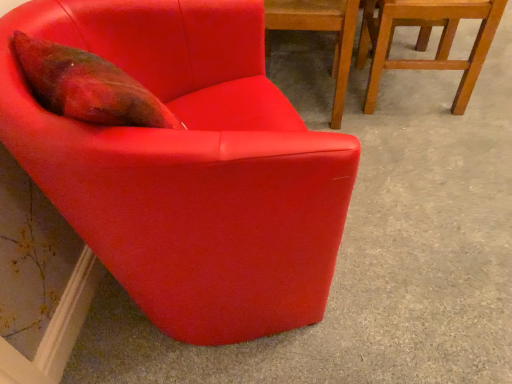
This screenshot has height=384, width=512. In order to click on wooden chair at upper right, which appears as the 3th chair when viewed from the left in this screenshot , I will do `click(426, 39)`.

Considering the positions of points (39, 25) and (350, 17), is point (39, 25) farther from camera compared to point (350, 17)?

No, (39, 25) is in front of (350, 17).

Considering the sizes of objects matte red armchair at upper left, arranged as the 3th chair when viewed from the right, and matte red chair at center, the second chair positioned from the right, in the image provided, who is smaller, matte red armchair at upper left, arranged as the 3th chair when viewed from the right, or matte red chair at center, the second chair positioned from the right,?

matte red chair at center, the second chair positioned from the right.

From the image's perspective, who appears lower, matte red armchair at upper left, which is counted as the first chair, starting from the left, or matte red chair at center, the second chair positioned from the right?

matte red armchair at upper left, which is counted as the first chair, starting from the left, from the image's perspective.

Consider the image. Which is in front, matte red chair at center, the second chair positioned from the right, or wooden chair at upper right, which appears as the 3th chair when viewed from the left?

matte red chair at center, the second chair positioned from the right.

From the picture: From the image's perspective, between matte red chair at center, which ranks as the 2th chair in left-to-right order, and wooden chair at upper right, which appears as the 3th chair when viewed from the left, which one is located above?

wooden chair at upper right, which appears as the 3th chair when viewed from the left, appears higher in the image.

In the scene shown: Is matte red chair at center, the second chair positioned from the right, situated inside wooden chair at upper right, which appears as the 1th chair when viewed from the right, or outside?

matte red chair at center, the second chair positioned from the right, is not inside wooden chair at upper right, which appears as the 1th chair when viewed from the right, it's outside.

Is matte red chair at center, the second chair positioned from the right, thinner than wooden chair at upper right, which appears as the 3th chair when viewed from the left?

In fact, matte red chair at center, the second chair positioned from the right, might be wider than wooden chair at upper right, which appears as the 3th chair when viewed from the left.

Is wooden chair at upper right, which appears as the 3th chair when viewed from the left, inside or outside of matte red chair at center, which ranks as the 2th chair in left-to-right order?

wooden chair at upper right, which appears as the 3th chair when viewed from the left, is not inside matte red chair at center, which ranks as the 2th chair in left-to-right order, it's outside.

Where is `chair behind the matte red chair at center, which ranks as the 2th chair in left-to-right order`? chair behind the matte red chair at center, which ranks as the 2th chair in left-to-right order is located at coordinates (426, 39).

In terms of height, does wooden chair at upper right, which appears as the 3th chair when viewed from the left, look taller or shorter compared to matte red chair at center, which ranks as the 2th chair in left-to-right order?

Considering their sizes, wooden chair at upper right, which appears as the 3th chair when viewed from the left, has less height than matte red chair at center, which ranks as the 2th chair in left-to-right order.

Between wooden chair at upper right, which appears as the 3th chair when viewed from the left, and matte red chair at center, the second chair positioned from the right, which one is positioned behind?

wooden chair at upper right, which appears as the 3th chair when viewed from the left, is further from the camera.

From the image's perspective, which is above, matte red armchair at upper left, arranged as the 3th chair when viewed from the right, or wooden chair at upper right, which appears as the 1th chair when viewed from the right?

wooden chair at upper right, which appears as the 1th chair when viewed from the right, is shown above in the image.

Does matte red armchair at upper left, which is counted as the first chair, starting from the left, have a greater height compared to wooden chair at upper right, which appears as the 1th chair when viewed from the right?

Correct, matte red armchair at upper left, which is counted as the first chair, starting from the left, is much taller as wooden chair at upper right, which appears as the 1th chair when viewed from the right.

Looking at this image, what's the angular difference between matte red armchair at upper left, arranged as the 3th chair when viewed from the right, and wooden chair at upper right, which appears as the 3th chair when viewed from the left,'s facing directions?

160 degrees separate the facing orientations of matte red armchair at upper left, arranged as the 3th chair when viewed from the right, and wooden chair at upper right, which appears as the 3th chair when viewed from the left.

Is matte red armchair at upper left, which is counted as the first chair, starting from the left, facing towards wooden chair at upper right, which appears as the 1th chair when viewed from the right?

No.

In terms of height, does matte red chair at center, which ranks as the 2th chair in left-to-right order, look taller or shorter compared to matte red armchair at upper left, arranged as the 3th chair when viewed from the right?

Considering their sizes, matte red chair at center, which ranks as the 2th chair in left-to-right order, has less height than matte red armchair at upper left, arranged as the 3th chair when viewed from the right.

Is matte red chair at center, which ranks as the 2th chair in left-to-right order, not close to matte red armchair at upper left, which is counted as the first chair, starting from the left?

matte red chair at center, which ranks as the 2th chair in left-to-right order, is near matte red armchair at upper left, which is counted as the first chair, starting from the left, not far away.

Is matte red chair at center, the second chair positioned from the right, facing away from matte red armchair at upper left, arranged as the 3th chair when viewed from the right?

Yes, matte red chair at center, the second chair positioned from the right,'s orientation is away from matte red armchair at upper left, arranged as the 3th chair when viewed from the right.

Which of these two, matte red chair at center, which ranks as the 2th chair in left-to-right order, or matte red armchair at upper left, which is counted as the first chair, starting from the left, is wider?

With larger width is matte red armchair at upper left, which is counted as the first chair, starting from the left.

From a real-world perspective, is wooden chair at upper right, which appears as the 3th chair when viewed from the left, positioned under matte red armchair at upper left, which is counted as the first chair, starting from the left, based on gravity?

Indeed, from a real-world perspective, wooden chair at upper right, which appears as the 3th chair when viewed from the left, is positioned beneath matte red armchair at upper left, which is counted as the first chair, starting from the left.

Does wooden chair at upper right, which appears as the 3th chair when viewed from the left, lie in front of matte red armchair at upper left, arranged as the 3th chair when viewed from the right?

No, wooden chair at upper right, which appears as the 3th chair when viewed from the left, is further to the viewer.

Which is closer, [474,65] or [187,295]?

The point [187,295] is in front.

Locate an element on the screen. The image size is (512, 384). chair in front of the matte red chair at center, which ranks as the 2th chair in left-to-right order is located at coordinates (189, 168).

Find the location of `chair that is the 1st one when counting downward from the wooden chair at upper right, which appears as the 3th chair when viewed from the left (from the image's perspective)`. chair that is the 1st one when counting downward from the wooden chair at upper right, which appears as the 3th chair when viewed from the left (from the image's perspective) is located at coordinates coord(321,30).

Based on their spatial positions, is wooden chair at upper right, which appears as the 3th chair when viewed from the left, or matte red chair at center, which ranks as the 2th chair in left-to-right order, closer to matte red armchair at upper left, which is counted as the first chair, starting from the left?

matte red chair at center, which ranks as the 2th chair in left-to-right order, lies closer to matte red armchair at upper left, which is counted as the first chair, starting from the left, than the other object.

Looking at this image, looking at the image, which one is located further to matte red chair at center, which ranks as the 2th chair in left-to-right order, wooden chair at upper right, which appears as the 3th chair when viewed from the left, or matte red armchair at upper left, which is counted as the first chair, starting from the left?

Based on the image, matte red armchair at upper left, which is counted as the first chair, starting from the left, appears to be further to matte red chair at center, which ranks as the 2th chair in left-to-right order.

Estimate the real-world distances between objects in this image. Which object is closer to wooden chair at upper right, which appears as the 3th chair when viewed from the left, matte red chair at center, the second chair positioned from the right, or matte red armchair at upper left, arranged as the 3th chair when viewed from the right?

Among the two, matte red chair at center, the second chair positioned from the right, is located nearer to wooden chair at upper right, which appears as the 3th chair when viewed from the left.

Looking at the image, which one is located further to matte red chair at center, the second chair positioned from the right, matte red armchair at upper left, arranged as the 3th chair when viewed from the right, or wooden chair at upper right, which appears as the 3th chair when viewed from the left?

matte red armchair at upper left, arranged as the 3th chair when viewed from the right, is further to matte red chair at center, the second chair positioned from the right.

Based on their spatial positions, is matte red armchair at upper left, arranged as the 3th chair when viewed from the right, or matte red chair at center, which ranks as the 2th chair in left-to-right order, further from wooden chair at upper right, which appears as the 1th chair when viewed from the right?

matte red armchair at upper left, arranged as the 3th chair when viewed from the right, lies further to wooden chair at upper right, which appears as the 1th chair when viewed from the right, than the other object.

Considering their positions, is matte red chair at center, which ranks as the 2th chair in left-to-right order, positioned further to matte red armchair at upper left, arranged as the 3th chair when viewed from the right, than wooden chair at upper right, which appears as the 3th chair when viewed from the left?

Among the two, wooden chair at upper right, which appears as the 3th chair when viewed from the left, is located further to matte red armchair at upper left, arranged as the 3th chair when viewed from the right.

Find the location of a particular element. Image resolution: width=512 pixels, height=384 pixels. chair located between matte red armchair at upper left, arranged as the 3th chair when viewed from the right, and wooden chair at upper right, which appears as the 1th chair when viewed from the right, in the depth direction is located at coordinates (321, 30).